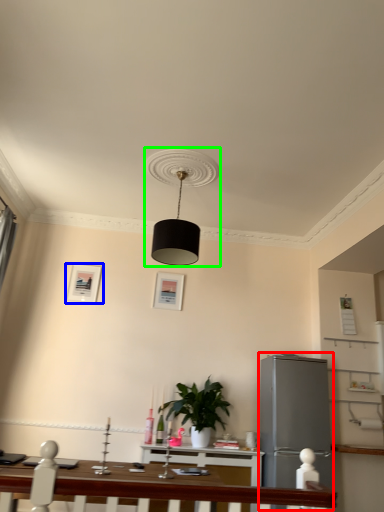
Question: Which object is positioned closest to appliance (highlighted by a red box)? Select from picture frame (highlighted by a blue box) and lamp (highlighted by a green box).

Choices:
 (A) picture frame
 (B) lamp

Answer: (B)